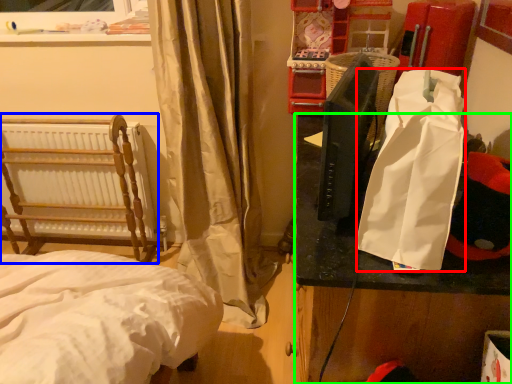
Question: Which is nearer to the shopping bag (highlighted by a red box)? furniture (highlighted by a blue box) or table (highlighted by a green box).

Choices:
 (A) furniture
 (B) table

Answer: (B)